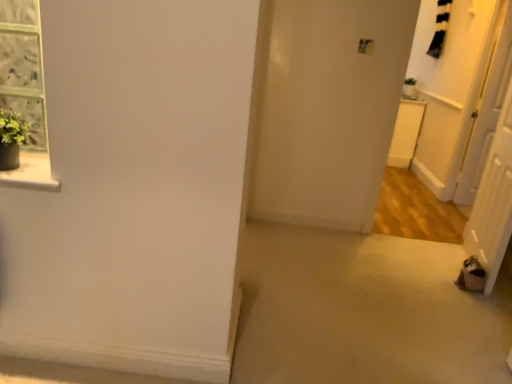
Image resolution: width=512 pixels, height=384 pixels. What do you see at coordinates (486, 111) in the screenshot?
I see `white glossy door at right, marked as the 2th screen door in a front-to-back arrangement` at bounding box center [486, 111].

Measure the distance between point (477, 183) and camera.

Point (477, 183) is 13.66 feet away from camera.

Find the location of `white glossy door at right, marked as the 2th screen door in a front-to-back arrangement`. white glossy door at right, marked as the 2th screen door in a front-to-back arrangement is located at coordinates (486, 111).

What is the approximate width of white glossy door at right, which is the second screen door from left to right?

white glossy door at right, which is the second screen door from left to right, is 3.24 inches wide.

What is the approximate width of brown fabric screen door at lower right, positioned as the second screen door in back-to-front order?

19.19 centimeters.

Describe the element at coordinates (493, 201) in the screenshot. I see `brown fabric screen door at lower right, the 2th screen door viewed from the right` at that location.

Identify the location of brown fabric screen door at lower right, the 2th screen door viewed from the right. The image size is (512, 384). coord(493,201).

Find the location of `white glossy door at right, marked as the 2th screen door in a front-to-back arrangement`. white glossy door at right, marked as the 2th screen door in a front-to-back arrangement is located at coordinates (486, 111).

In the image, is white glossy door at right, marked as the 2th screen door in a front-to-back arrangement, on the left side or the right side of brown fabric screen door at lower right, the 2th screen door viewed from the right?

From the image, it's evident that white glossy door at right, marked as the 2th screen door in a front-to-back arrangement, is to the right of brown fabric screen door at lower right, the 2th screen door viewed from the right.

Based on the photo, relative to brown fabric screen door at lower right, the 2th screen door viewed from the right, is white glossy door at right, acting as the 1th screen door starting from the right, in front or behind?

In the image, white glossy door at right, acting as the 1th screen door starting from the right, appears behind brown fabric screen door at lower right, the 2th screen door viewed from the right.

Which is further, (469, 141) or (484, 179)?

Positioned behind is point (469, 141).

From the image's perspective, between white glossy door at right, the first screen door in the back-to-front sequence, and brown fabric screen door at lower right, which is the 1th screen door from front to back, who is located below?

brown fabric screen door at lower right, which is the 1th screen door from front to back, appears lower in the image.

From a real-world perspective, is white glossy door at right, acting as the 1th screen door starting from the right, on brown fabric screen door at lower right, positioned as the second screen door in back-to-front order?

Yes, from a real-world perspective, white glossy door at right, acting as the 1th screen door starting from the right, is over brown fabric screen door at lower right, positioned as the second screen door in back-to-front order

Which of these two, white glossy door at right, which is the second screen door from left to right, or brown fabric screen door at lower right, which is the 1th screen door from front to back, is thinner?

white glossy door at right, which is the second screen door from left to right.

Is white glossy door at right, acting as the 1th screen door starting from the right, taller or shorter than brown fabric screen door at lower right, the 2th screen door viewed from the right?

In the image, white glossy door at right, acting as the 1th screen door starting from the right, appears to be taller than brown fabric screen door at lower right, the 2th screen door viewed from the right.

Who is smaller, white glossy door at right, which is the second screen door from left to right, or brown fabric screen door at lower right, the 2th screen door viewed from the right?

Smaller between the two is white glossy door at right, which is the second screen door from left to right.

Is white glossy door at right, acting as the 1th screen door starting from the right, completely or partially outside of brown fabric screen door at lower right, positioned as the second screen door in back-to-front order?

white glossy door at right, acting as the 1th screen door starting from the right, lies outside brown fabric screen door at lower right, positioned as the second screen door in back-to-front order,'s area.

Is white glossy door at right, the first screen door in the back-to-front sequence, touching brown fabric screen door at lower right, which is the 1th screen door from front to back?

No, white glossy door at right, the first screen door in the back-to-front sequence, is not making contact with brown fabric screen door at lower right, which is the 1th screen door from front to back.

Is white glossy door at right, which is the second screen door from left to right, facing towards brown fabric screen door at lower right, positioned as the second screen door in back-to-front order?

No.

What's the angular difference between white glossy door at right, marked as the 2th screen door in a front-to-back arrangement, and brown fabric screen door at lower right, which is the 1th screen door from front to back,'s facing directions?

They differ by 98.2 degrees in their facing directions.

Could you measure the distance between white glossy door at right, which is the second screen door from left to right, and brown fabric screen door at lower right, the 1th screen door from the left?

A distance of 75.36 centimeters exists between white glossy door at right, which is the second screen door from left to right, and brown fabric screen door at lower right, the 1th screen door from the left.

Where is `screen door that appears above the brown fabric screen door at lower right, the 1th screen door from the left (from a real-world perspective)`? This screenshot has width=512, height=384. screen door that appears above the brown fabric screen door at lower right, the 1th screen door from the left (from a real-world perspective) is located at coordinates (486, 111).

Between brown fabric screen door at lower right, which is the 1th screen door from front to back, and white glossy door at right, marked as the 2th screen door in a front-to-back arrangement, which one appears on the right side from the viewer's perspective?

From the viewer's perspective, white glossy door at right, marked as the 2th screen door in a front-to-back arrangement, appears more on the right side.

Which is behind, brown fabric screen door at lower right, which is the 1th screen door from front to back, or white glossy door at right, which is the second screen door from left to right?

white glossy door at right, which is the second screen door from left to right, is behind.

Is point (511, 85) farther from camera compared to point (488, 139)?

No.

From the image's perspective, between brown fabric screen door at lower right, which is the 1th screen door from front to back, and white glossy door at right, marked as the 2th screen door in a front-to-back arrangement, who is located below?

brown fabric screen door at lower right, which is the 1th screen door from front to back, appears lower in the image.

From a real-world perspective, does brown fabric screen door at lower right, which is the 1th screen door from front to back, sit lower than white glossy door at right, which is the second screen door from left to right?

Indeed, from a real-world perspective, brown fabric screen door at lower right, which is the 1th screen door from front to back, is positioned beneath white glossy door at right, which is the second screen door from left to right.

Does brown fabric screen door at lower right, positioned as the second screen door in back-to-front order, have a lesser width compared to white glossy door at right, which is the second screen door from left to right?

No, brown fabric screen door at lower right, positioned as the second screen door in back-to-front order, is not thinner than white glossy door at right, which is the second screen door from left to right.

Between brown fabric screen door at lower right, which is the 1th screen door from front to back, and white glossy door at right, the first screen door in the back-to-front sequence, which one has more height?

Standing taller between the two is white glossy door at right, the first screen door in the back-to-front sequence.

Considering the sizes of objects brown fabric screen door at lower right, which is the 1th screen door from front to back, and white glossy door at right, which is the second screen door from left to right, in the image provided, who is bigger, brown fabric screen door at lower right, which is the 1th screen door from front to back, or white glossy door at right, which is the second screen door from left to right,?

With larger size is brown fabric screen door at lower right, which is the 1th screen door from front to back.

Is brown fabric screen door at lower right, positioned as the second screen door in back-to-front order, located outside white glossy door at right, which is the second screen door from left to right?

A: Absolutely, brown fabric screen door at lower right, positioned as the second screen door in back-to-front order, is external to white glossy door at right, which is the second screen door from left to right.

Is brown fabric screen door at lower right, the 1th screen door from the left, touching white glossy door at right, the first screen door in the back-to-front sequence?

No, brown fabric screen door at lower right, the 1th screen door from the left, is not next to white glossy door at right, the first screen door in the back-to-front sequence.

Based on the photo, does brown fabric screen door at lower right, the 1th screen door from the left, turn towards white glossy door at right, marked as the 2th screen door in a front-to-back arrangement?

No, brown fabric screen door at lower right, the 1th screen door from the left, is not facing towards white glossy door at right, marked as the 2th screen door in a front-to-back arrangement.

How different are the orientations of brown fabric screen door at lower right, the 1th screen door from the left, and white glossy door at right, acting as the 1th screen door starting from the right, in degrees?

98.2 degrees separate the facing orientations of brown fabric screen door at lower right, the 1th screen door from the left, and white glossy door at right, acting as the 1th screen door starting from the right.

Find the location of a particular element. screen door located on the right of brown fabric screen door at lower right, positioned as the second screen door in back-to-front order is located at coordinates (486, 111).

Locate an element on the screen. The width and height of the screenshot is (512, 384). screen door located on the left of white glossy door at right, marked as the 2th screen door in a front-to-back arrangement is located at coordinates (493, 201).

At what (x,y) coordinates should I click in order to perform the action: click on screen door below the white glossy door at right, acting as the 1th screen door starting from the right (from the image's perspective). Please return your answer as a coordinate pair (x, y). Looking at the image, I should click on (493, 201).